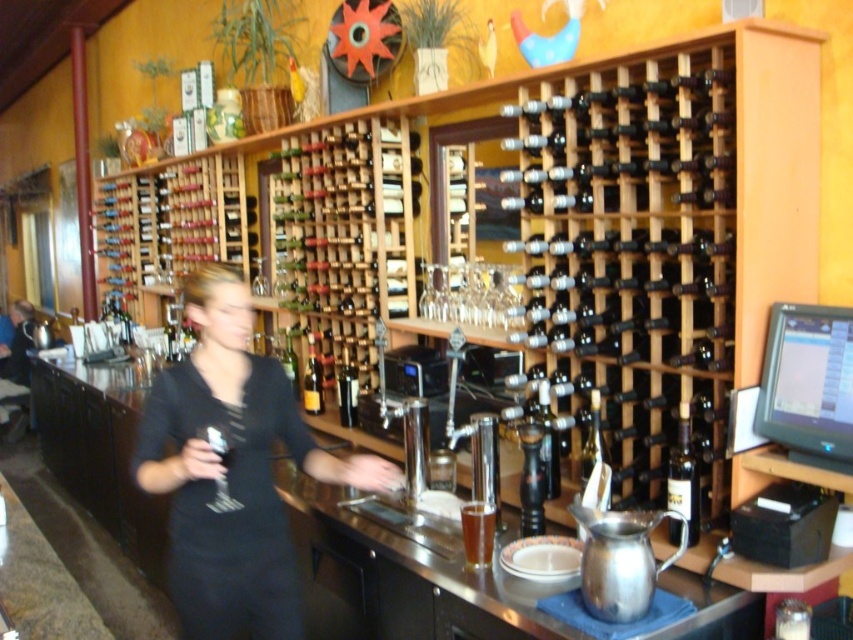
Question: Among these objects, which one is nearest to the camera?

Choices:
 (A) wooden wine rack at upper center
 (B) translucent glass beer at bar center

Answer: (A)

Question: Observing the image, what is the correct spatial positioning of clear glass wine glass at center in reference to shiny dark glass bottle at center?

Choices:
 (A) below
 (B) above

Answer: (A)

Question: Among these objects, which one is farthest from the camera?

Choices:
 (A) black fabric dress at center
 (B) dark brown glass bottle at center-right
 (C) translucent glass beer at bar center

Answer: (C)

Question: Is brown wooden wine rack at upper right wider than dark brown glass bottle at center-right?

Choices:
 (A) yes
 (B) no

Answer: (A)

Question: Which of these objects is positioned farthest from the shiny dark glass bottle at center?

Choices:
 (A) wooden wine rack at upper center
 (B) brown wooden wine rack at upper right

Answer: (B)

Question: Where is wooden wine rack at upper center located in relation to matte black shirt at left in the image?

Choices:
 (A) below
 (B) above

Answer: (B)